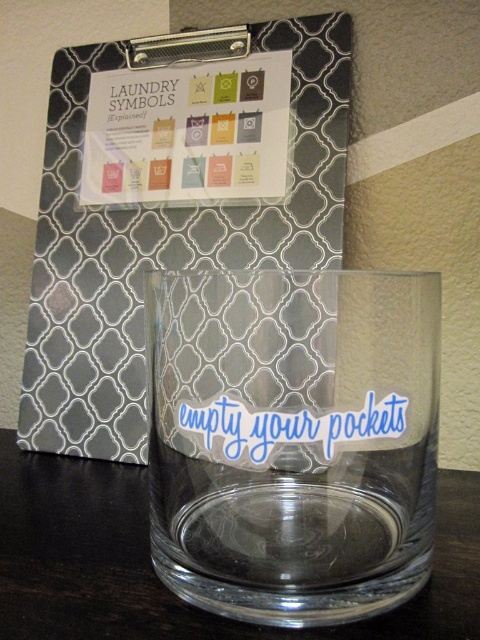
You are organizing a storage area and need to place the transparent glass at center and the transparent glass at lower center on a shelf. Which one should you place first to ensure both fit properly?

You should place the transparent glass at lower center first because it occupies more space than the transparent glass at center, allowing both to fit properly on the shelf.

You are standing in front of a wall with a clipboard and a glass container. You want to touch the transparent plastic clipboard at upper left first before reaching for the transparent glass at lower center. Which object will require you to stretch your arm more?

The transparent glass at lower center will require stretching your arm more because it is further away from you than the transparent plastic clipboard at upper left.

You are organizing a workshop and need to place the transparent plastic clipboard at upper left and the transparent glass at lower center on a shelf. The shelf has a height limit of 10 inches. Which object might not fit if placed vertically?

The transparent plastic clipboard at upper left is taller than the transparent glass at lower center, so the transparent plastic clipboard at upper left might not fit on the shelf if placed vertically due to its greater height.